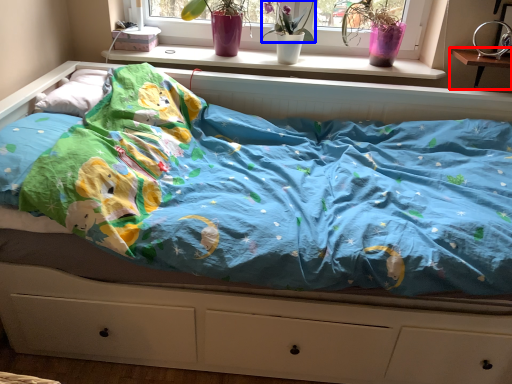
Question: Among these objects, which one is nearest to the camera, changing table (highlighted by a red box) or floral arrangement (highlighted by a blue box)?

Choices:
 (A) changing table
 (B) floral arrangement

Answer: (A)